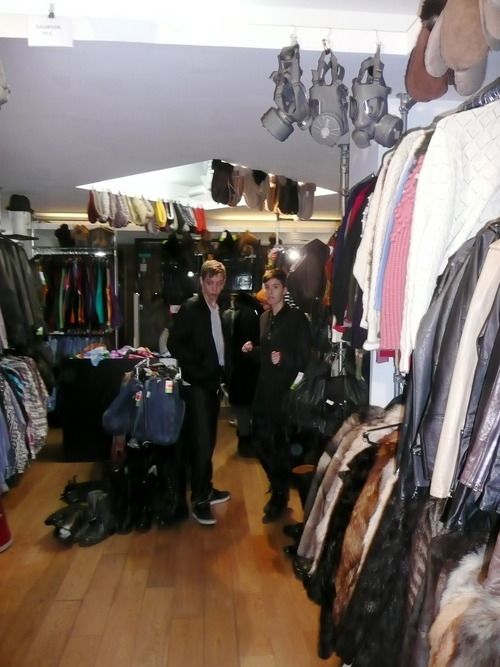
The image size is (500, 667). Identify the location of light. (294, 255).